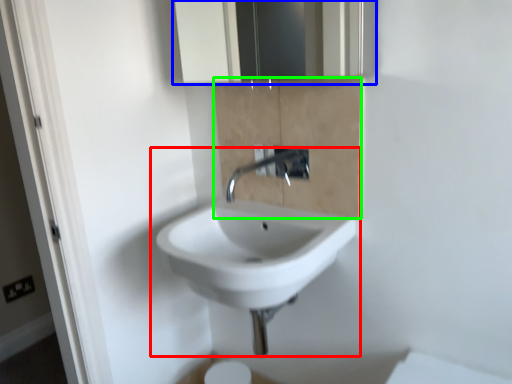
Question: Estimate the real-world distances between objects in this image. Which object is farther from sink (highlighted by a red box), medicine cabinet (highlighted by a blue box) or cabinetry (highlighted by a green box)?

Choices:
 (A) medicine cabinet
 (B) cabinetry

Answer: (A)